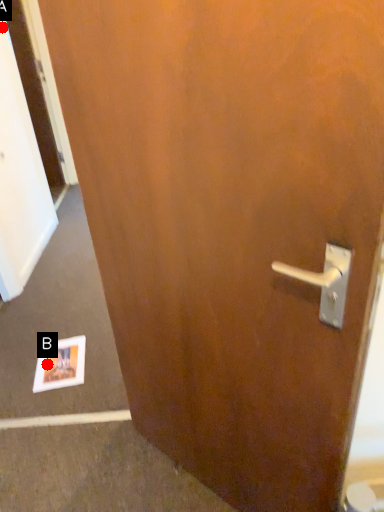
Question: Two points are circled on the image, labeled by A and B beside each circle. Among these points, which one is farthest from the camera?

Choices:
 (A) A is further
 (B) B is further

Answer: (A)